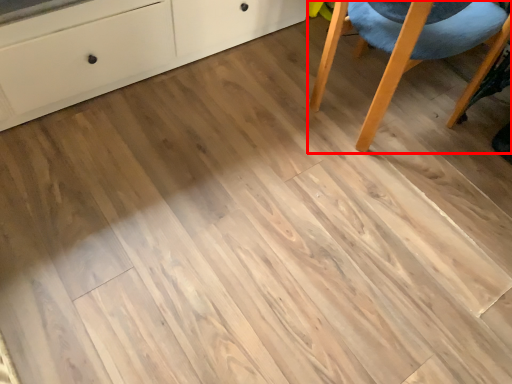
Question: From the image, what is the correct spatial relationship of chair (annotated by the red box) in relation to chest of drawers?

Choices:
 (A) right
 (B) left

Answer: (A)